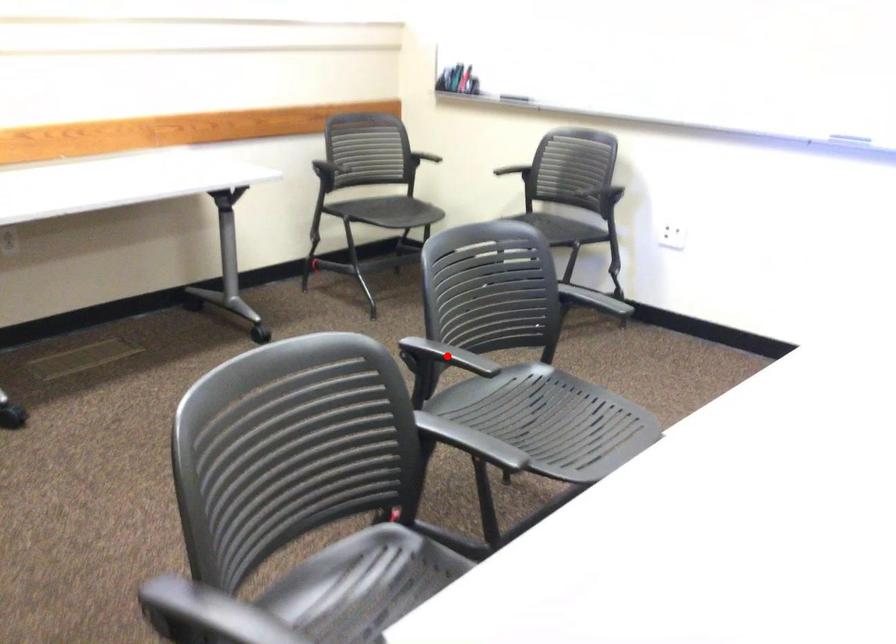
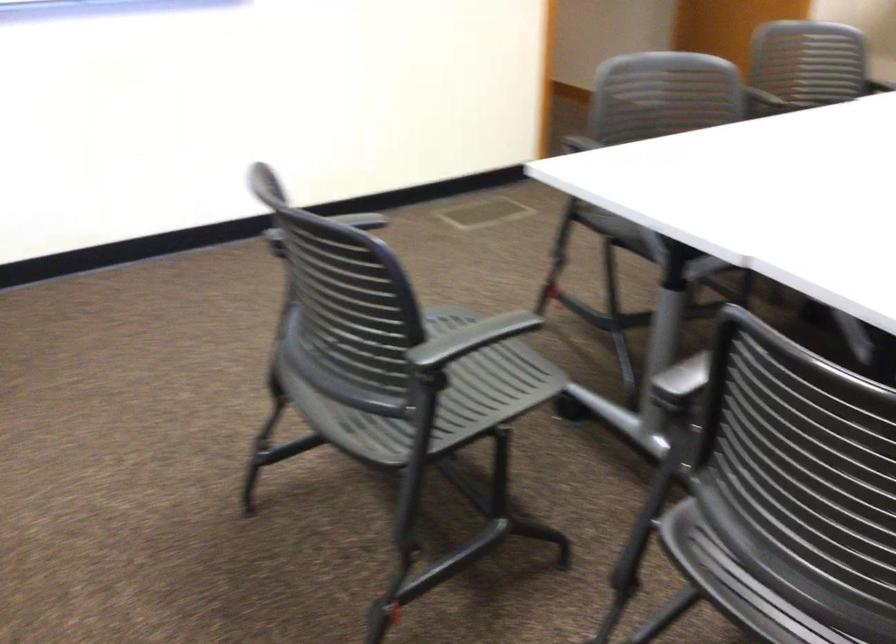
Question: I am providing you with two images of the same scene from different viewpoints. A red point is marked on the first image. Can you still see the location of the red point in image 2?

Choices:
 (A) Yes
 (B) No

Answer: (B)